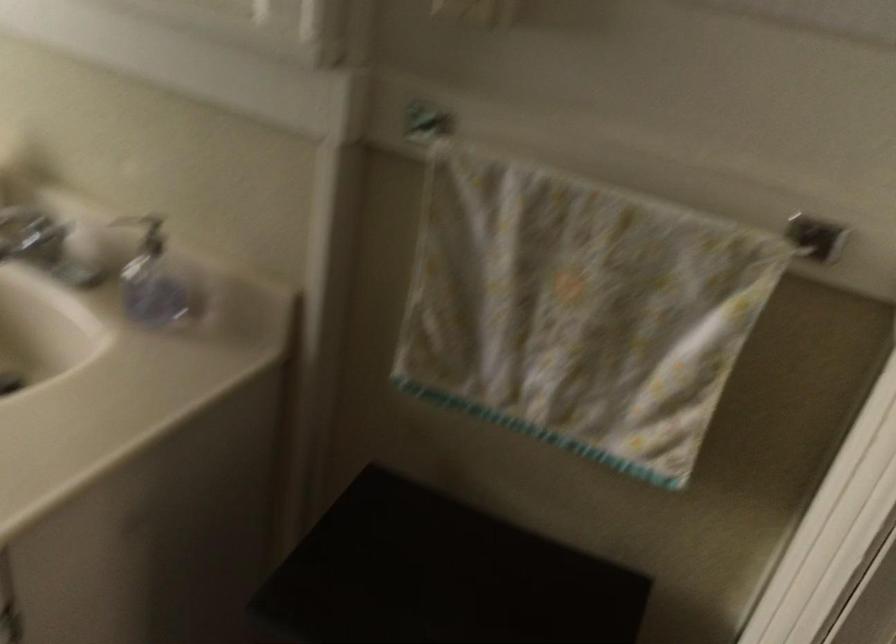
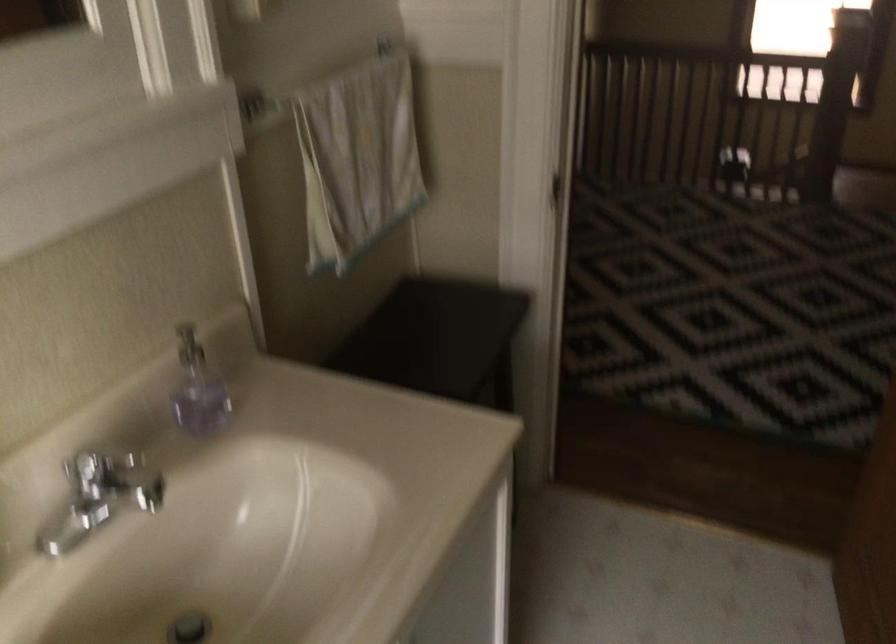
Where in the second image is the point corresponding to point (543, 294) from the first image?

(357, 158)